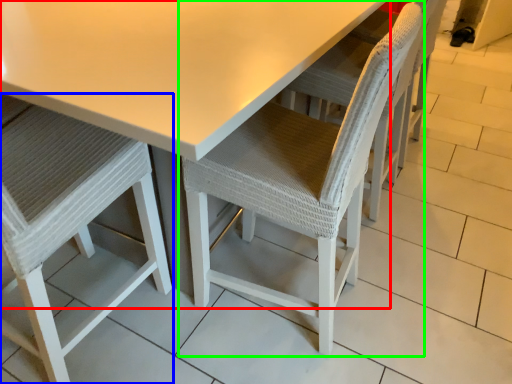
Question: Which object is the farthest from table (highlighted by a red box)? Choose among these: chair (highlighted by a blue box) or chair (highlighted by a green box).

Choices:
 (A) chair
 (B) chair

Answer: (A)